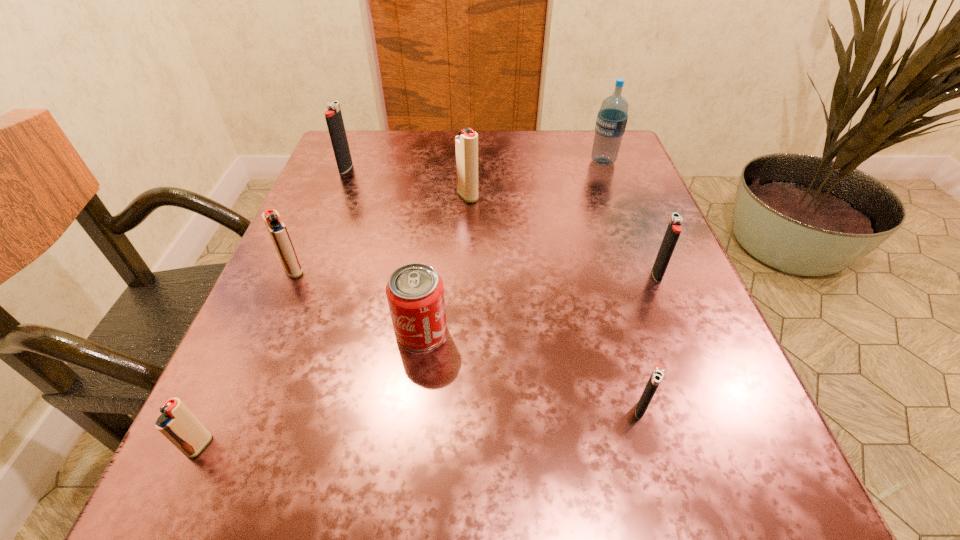
The height and width of the screenshot is (540, 960). What are the coordinates of `vacant space located on the right of the fifth object from right to left` in the screenshot? It's located at (674, 332).

The width and height of the screenshot is (960, 540). I want to click on vacant area situated 0.340m on the back of the smallest red igniter, so click(289, 252).

This screenshot has width=960, height=540. What are the coordinates of `free space located on the left of the seventh farthest object` in the screenshot? It's located at (526, 409).

Locate an element on the screen. water bottle located in the far edge section of the desktop is located at coordinates (611, 122).

Where is `igniter situated at the far edge`? This screenshot has width=960, height=540. igniter situated at the far edge is located at coordinates (333, 116).

Find the location of a particular element. This screenshot has height=540, width=960. object located in the near edge section of the desktop is located at coordinates click(177, 423).

Identify the location of water bottle positioned at the right edge. The width and height of the screenshot is (960, 540). (611, 122).

I want to click on object located at the far left corner, so click(x=333, y=116).

You are a GUI agent. You are given a task and a screenshot of the screen. Output one action in this format:
    pyautogui.click(x=<x>, y=<y>)
    Task: Click on the object present at the near left corner
    The image size is (960, 540).
    Given the screenshot: What is the action you would take?
    pyautogui.click(x=177, y=423)

Identify the location of object that is at the far right corner. The image size is (960, 540). (611, 122).